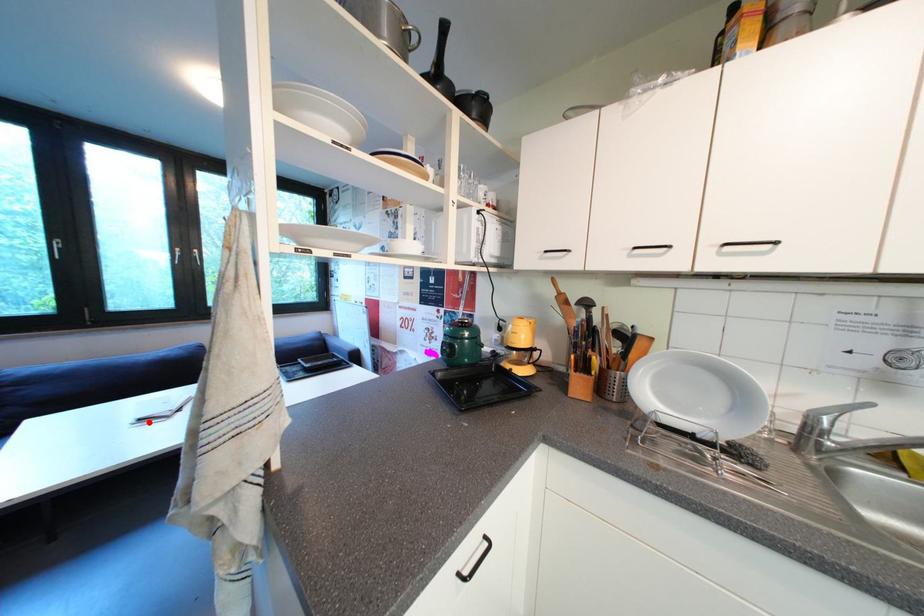
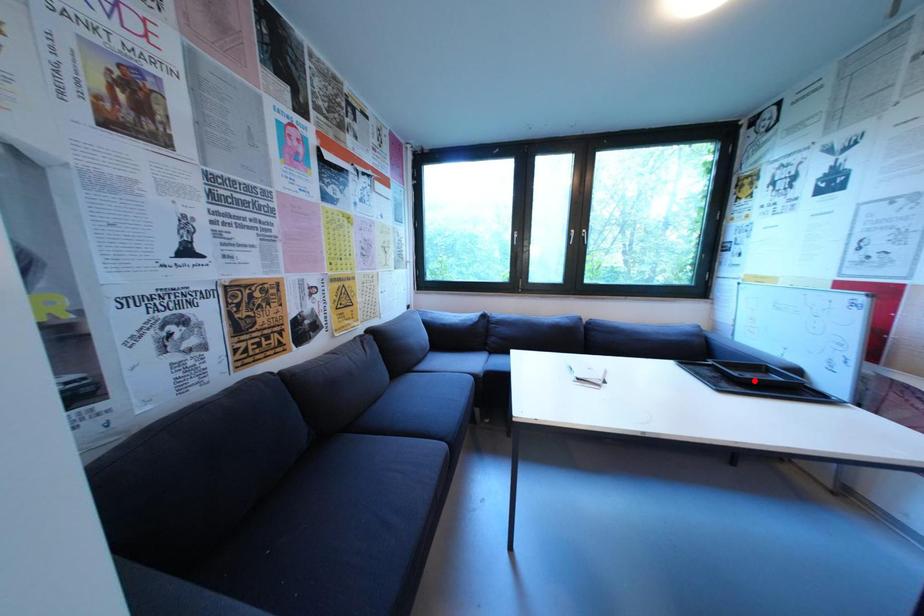
I am providing you with two images of the same scene from different viewpoints. A red point is marked on the first image and another point is marked on the second image. Does the point marked in image1 correspond to the same location as the one in image2?

No